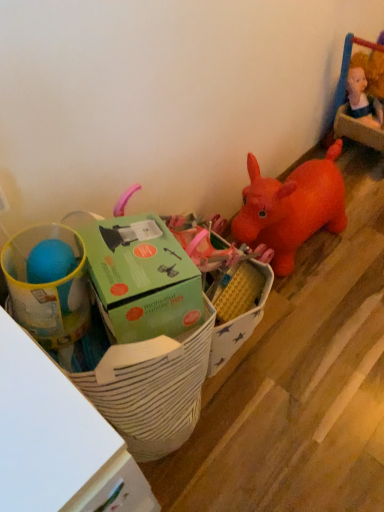
Where is `green cardboard box at left, which is the 2th toy from left to right`? The height and width of the screenshot is (512, 384). green cardboard box at left, which is the 2th toy from left to right is located at coordinates (142, 276).

What are the coordinates of `green cardboard box at center` in the screenshot? It's located at (238, 327).

Is green cardboard box at left, which is the 2th toy from left to right, turned away from white striped fabric basket at lower left?

No, green cardboard box at left, which is the 2th toy from left to right,'s orientation is not away from white striped fabric basket at lower left.

Between green cardboard box at left, which is the 2th toy from left to right, and white striped fabric basket at lower left, which one appears on the left side from the viewer's perspective?

Positioned to the left is white striped fabric basket at lower left.

From the picture: Who is taller, green cardboard box at left, arranged as the 1th toy when viewed from the right, or white striped fabric basket at lower left?

white striped fabric basket at lower left is taller.

Is green cardboard box at left, arranged as the 1th toy when viewed from the right, not within white striped fabric basket at lower left?

Absolutely, green cardboard box at left, arranged as the 1th toy when viewed from the right, is external to white striped fabric basket at lower left.

Are matte plastic cup at left, the 2th toy positioned from the right, and green cardboard box at center making contact?

No, matte plastic cup at left, the 2th toy positioned from the right, is not making contact with green cardboard box at center.

Which is more to the right, matte plastic cup at left, the 2th toy positioned from the right, or green cardboard box at center?

green cardboard box at center.

Where is `toy that is the 1st object located in front of the green cardboard box at center`? This screenshot has height=512, width=384. toy that is the 1st object located in front of the green cardboard box at center is located at coordinates (48, 289).

How different are the orientations of matte plastic cup at left, positioned as the first toy in left-to-right order, and green cardboard box at center in degrees?

The angular difference between matte plastic cup at left, positioned as the first toy in left-to-right order, and green cardboard box at center is 0.00061 degrees.

Is green cardboard box at center in front of or behind matte plastic cup at left, positioned as the first toy in left-to-right order, in the image?

Visually, green cardboard box at center is located behind matte plastic cup at left, positioned as the first toy in left-to-right order.

Which of these two, green cardboard box at center or matte plastic cup at left, the 2th toy positioned from the right, is bigger?

green cardboard box at center is bigger.

Considering the sizes of objects green cardboard box at center and matte plastic cup at left, the 2th toy positioned from the right, in the image provided, who is taller, green cardboard box at center or matte plastic cup at left, the 2th toy positioned from the right,?

green cardboard box at center is taller.

How much distance is there between green cardboard box at center and matte plastic cup at left, positioned as the first toy in left-to-right order?

The distance of green cardboard box at center from matte plastic cup at left, positioned as the first toy in left-to-right order, is 17.08 inches.

Is white striped fabric basket at lower left oriented away from green cardboard box at center?

white striped fabric basket at lower left does not have its back to green cardboard box at center.

Can you confirm if white striped fabric basket at lower left is smaller than green cardboard box at center?

No, white striped fabric basket at lower left is not smaller than green cardboard box at center.

From a real-world perspective, is white striped fabric basket at lower left below green cardboard box at center?

No.

In terms of width, does white striped fabric basket at lower left look wider or thinner when compared to green cardboard box at center?

In the image, white striped fabric basket at lower left appears to be wider than green cardboard box at center.

Measure the distance between white striped fabric basket at lower left and green cardboard box at left, arranged as the 1th toy when viewed from the right.

white striped fabric basket at lower left is 15.44 centimeters from green cardboard box at left, arranged as the 1th toy when viewed from the right.

What's the angular difference between white striped fabric basket at lower left and green cardboard box at left, which is the 2th toy from left to right,'s facing directions?

There is a 25.6-degree angle between the facing directions of white striped fabric basket at lower left and green cardboard box at left, which is the 2th toy from left to right.

Who is taller, white striped fabric basket at lower left or green cardboard box at left, arranged as the 1th toy when viewed from the right?

With more height is white striped fabric basket at lower left.

From a real-world perspective, is white striped fabric basket at lower left above or below green cardboard box at left, which is the 2th toy from left to right?

white striped fabric basket at lower left is below green cardboard box at left, which is the 2th toy from left to right.

From the image's perspective, who appears lower, green cardboard box at center or green cardboard box at left, arranged as the 1th toy when viewed from the right?

green cardboard box at center, from the image's perspective.

Measure the distance between green cardboard box at center and green cardboard box at left, arranged as the 1th toy when viewed from the right.

13.22 inches.

You are a GUI agent. You are given a task and a screenshot of the screen. Output one action in this format:
    pyautogui.click(x=<x>, y=<y>)
    Task: Click on the storage box located on the right of green cardboard box at left, which is the 2th toy from left to right
    Image resolution: width=384 pixels, height=512 pixels.
    Given the screenshot: What is the action you would take?
    pyautogui.click(x=238, y=327)

From a real-world perspective, between green cardboard box at center and green cardboard box at left, arranged as the 1th toy when viewed from the right, who is vertically higher?

green cardboard box at left, arranged as the 1th toy when viewed from the right, from a real-world perspective.

Is green cardboard box at left, which is the 2th toy from left to right, looking in the opposite direction of green cardboard box at center?

No, green cardboard box at left, which is the 2th toy from left to right, is not facing the opposite direction of green cardboard box at center.

Is green cardboard box at left, which is the 2th toy from left to right, closer to camera compared to green cardboard box at center?

Yes.

Considering the positions of point (106, 276) and point (246, 319), is point (106, 276) closer or farther from the camera than point (246, 319)?

Point (106, 276) appears to be closer to the viewer than point (246, 319).

What's the angular difference between green cardboard box at left, which is the 2th toy from left to right, and green cardboard box at center's facing directions?

The angular difference between green cardboard box at left, which is the 2th toy from left to right, and green cardboard box at center is 25.6 degrees.

You are a GUI agent. You are given a task and a screenshot of the screen. Output one action in this format:
    pyautogui.click(x=<x>, y=<y>)
    Task: Click on the 2nd toy to the right when counting from the white striped fabric basket at lower left
    The height and width of the screenshot is (512, 384).
    Given the screenshot: What is the action you would take?
    pyautogui.click(x=142, y=276)

Where is `storage box below the matte plastic cup at left, positioned as the first toy in left-to-right order (from the image's perspective)`? storage box below the matte plastic cup at left, positioned as the first toy in left-to-right order (from the image's perspective) is located at coordinates (238, 327).

From the image, which object appears to be farther from green cardboard box at left, arranged as the 1th toy when viewed from the right, white striped fabric basket at lower left or green cardboard box at center?

The object further to green cardboard box at left, arranged as the 1th toy when viewed from the right, is green cardboard box at center.

Estimate the real-world distances between objects in this image. Which object is closer to green cardboard box at left, arranged as the 1th toy when viewed from the right, white striped fabric basket at lower left or matte plastic cup at left, positioned as the first toy in left-to-right order?

matte plastic cup at left, positioned as the first toy in left-to-right order, lies closer to green cardboard box at left, arranged as the 1th toy when viewed from the right, than the other object.

From the image, which object appears to be nearer to matte plastic cup at left, the 2th toy positioned from the right, white striped fabric basket at lower left or green cardboard box at left, which is the 2th toy from left to right?

Among the two, green cardboard box at left, which is the 2th toy from left to right, is located nearer to matte plastic cup at left, the 2th toy positioned from the right.

Based on their spatial positions, is green cardboard box at center or matte plastic cup at left, positioned as the first toy in left-to-right order, further from green cardboard box at left, which is the 2th toy from left to right?

The object further to green cardboard box at left, which is the 2th toy from left to right, is green cardboard box at center.

From the image, which object appears to be farther from matte plastic cup at left, positioned as the first toy in left-to-right order, green cardboard box at center or white striped fabric basket at lower left?

The object further to matte plastic cup at left, positioned as the first toy in left-to-right order, is green cardboard box at center.

When comparing their distances from green cardboard box at left, arranged as the 1th toy when viewed from the right, does matte plastic cup at left, positioned as the first toy in left-to-right order, or green cardboard box at center seem further?

green cardboard box at center.

From the image, which object appears to be farther from matte plastic cup at left, the 2th toy positioned from the right, green cardboard box at left, which is the 2th toy from left to right, or green cardboard box at center?

The object further to matte plastic cup at left, the 2th toy positioned from the right, is green cardboard box at center.

Which object lies nearer to the anchor point green cardboard box at center, white striped fabric basket at lower left or green cardboard box at left, which is the 2th toy from left to right?

white striped fabric basket at lower left is positioned closer to the anchor green cardboard box at center.

This screenshot has width=384, height=512. Identify the location of toy located between green cardboard box at left, which is the 2th toy from left to right, and green cardboard box at center in the depth direction. (x=48, y=289).

What are the coordinates of `toy between green cardboard box at left, which is the 2th toy from left to right, and white striped fabric basket at lower left in the up-down direction` in the screenshot? It's located at (48, 289).